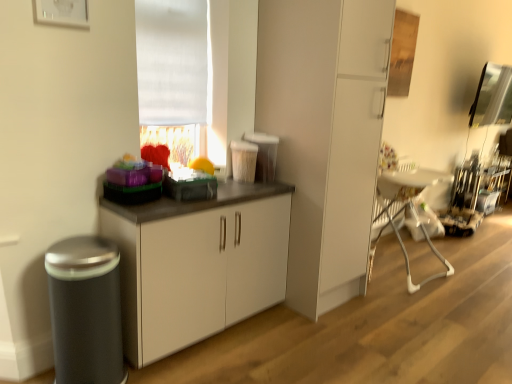
Where is `free space between white matte cabinet at center, marked as the 1th cabinetry in a right-to-left arrangement, and white matte cabinet at center, which is the 1th cabinetry in left-to-right order`? This screenshot has height=384, width=512. free space between white matte cabinet at center, marked as the 1th cabinetry in a right-to-left arrangement, and white matte cabinet at center, which is the 1th cabinetry in left-to-right order is located at coordinates (258, 330).